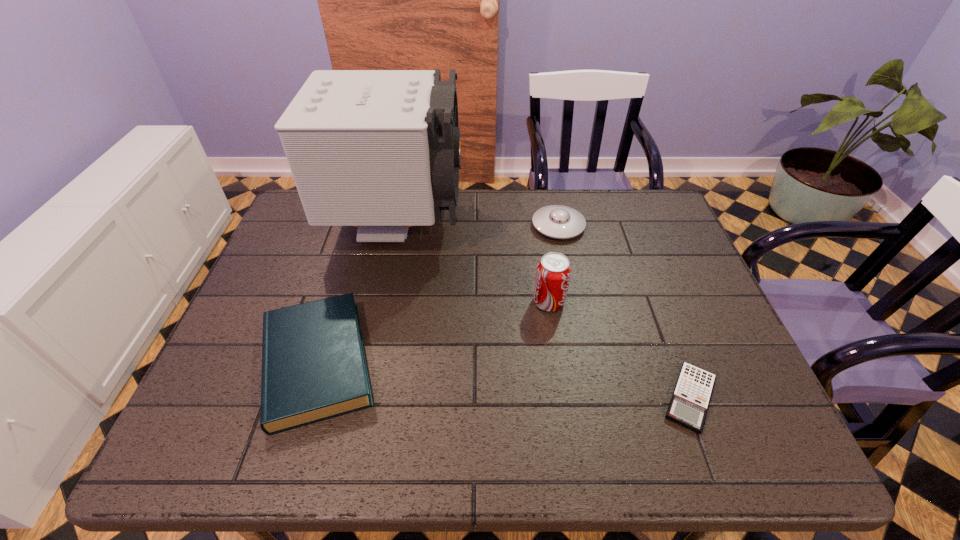
Locate an element on the screen. This screenshot has height=540, width=960. free spot that satisfies the following two spatial constraints: 1. on the front side of the book; 2. on the left side of the rightmost object is located at coordinates (306, 398).

The height and width of the screenshot is (540, 960). Find the location of `free space that satisfies the following two spatial constraints: 1. on the back side of the book; 2. on the right side of the fan`. free space that satisfies the following two spatial constraints: 1. on the back side of the book; 2. on the right side of the fan is located at coordinates [x=360, y=225].

You are a GUI agent. You are given a task and a screenshot of the screen. Output one action in this format:
    pyautogui.click(x=<x>, y=<y>)
    Task: Click on the blank space that satisfies the following two spatial constraints: 1. on the back side of the book; 2. on the left side of the saucer
    The image size is (960, 540).
    Given the screenshot: What is the action you would take?
    pyautogui.click(x=359, y=226)